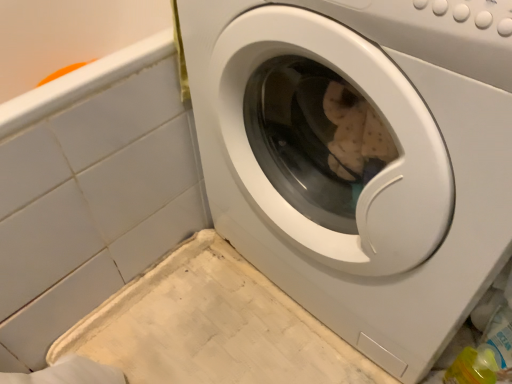
This screenshot has width=512, height=384. Find the location of `white glossy washing machine at center`. white glossy washing machine at center is located at coordinates (91, 191).

The height and width of the screenshot is (384, 512). What do you see at coordinates (91, 191) in the screenshot?
I see `white glossy washing machine at center` at bounding box center [91, 191].

Measure the distance between white glossy washing machine at center and camera.

14.00 inches.

This screenshot has width=512, height=384. What are the coordinates of `white glossy washing machine at center` in the screenshot? It's located at (361, 157).

Describe the element at coordinates (361, 157) in the screenshot. Image resolution: width=512 pixels, height=384 pixels. I see `white glossy washing machine at center` at that location.

What is the approximate height of white glossy washing machine at center?

The height of white glossy washing machine at center is 30.47 inches.

Locate an element on the screen. The image size is (512, 384). white glossy washing machine at center is located at coordinates (91, 191).

Considering the positions of objects white glossy washing machine at center and white glossy washing machine at center in the image provided, who is more to the left, white glossy washing machine at center or white glossy washing machine at center?

white glossy washing machine at center.

Is white glossy washing machine at center in front of or behind white glossy washing machine at center in the image?

white glossy washing machine at center is behind white glossy washing machine at center.

Considering the positions of point (125, 194) and point (509, 112), is point (125, 194) closer or farther from the camera than point (509, 112)?

Point (125, 194) is farther from the camera than point (509, 112).

From the image's perspective, which one is positioned higher, white glossy washing machine at center or white glossy washing machine at center?

white glossy washing machine at center, from the image's perspective.

From a real-world perspective, is white glossy washing machine at center below white glossy washing machine at center?

Yes, from a real-world perspective, white glossy washing machine at center is below white glossy washing machine at center.

Can you confirm if white glossy washing machine at center is thinner than white glossy washing machine at center?

No.

Can you confirm if white glossy washing machine at center is taller than white glossy washing machine at center?

No.

Considering the sizes of objects white glossy washing machine at center and white glossy washing machine at center in the image provided, who is smaller, white glossy washing machine at center or white glossy washing machine at center?

white glossy washing machine at center is smaller.

Could white glossy washing machine at center be considered to be inside white glossy washing machine at center?

No, white glossy washing machine at center does not contain white glossy washing machine at center.

Are white glossy washing machine at center and white glossy washing machine at center located far from each other?

They are positioned close to each other.

Is white glossy washing machine at center at the back of white glossy washing machine at center?

white glossy washing machine at center is not turned away from white glossy washing machine at center.

How many degrees apart are the facing directions of white glossy washing machine at center and white glossy washing machine at center?

90.6 degrees.

Measure the distance from white glossy washing machine at center to white glossy washing machine at center.

They are 12.97 inches apart.

I want to click on bath behind the white glossy washing machine at center, so pyautogui.click(x=91, y=191).

Is white glossy washing machine at center to the right of white glossy washing machine at center from the viewer's perspective?

Yes, white glossy washing machine at center is to the right of white glossy washing machine at center.

Which object is closer to the camera taking this photo, white glossy washing machine at center or white glossy washing machine at center?

white glossy washing machine at center.

Is point (203, 58) less distant than point (164, 12)?

Yes.

Looking at this image, from the image's perspective, is white glossy washing machine at center beneath white glossy washing machine at center?

Correct, white glossy washing machine at center appears lower than white glossy washing machine at center in the image.

From a real-world perspective, is white glossy washing machine at center above or below white glossy washing machine at center?

white glossy washing machine at center is situated higher than white glossy washing machine at center in the real world.

Considering the relative sizes of white glossy washing machine at center and white glossy washing machine at center in the image provided, is white glossy washing machine at center thinner than white glossy washing machine at center?

Indeed, white glossy washing machine at center has a lesser width compared to white glossy washing machine at center.

Considering the sizes of objects white glossy washing machine at center and white glossy washing machine at center in the image provided, who is taller, white glossy washing machine at center or white glossy washing machine at center?

white glossy washing machine at center.

Is white glossy washing machine at center bigger than white glossy washing machine at center?

Actually, white glossy washing machine at center might be smaller than white glossy washing machine at center.

Can white glossy washing machine at center be found inside white glossy washing machine at center?

Definitely not — white glossy washing machine at center is not inside white glossy washing machine at center.

Is white glossy washing machine at center far away from white glossy washing machine at center?

white glossy washing machine at center is actually quite close to white glossy washing machine at center.

Is white glossy washing machine at center aimed at white glossy washing machine at center?

No, white glossy washing machine at center is not facing towards white glossy washing machine at center.

How many degrees apart are the facing directions of white glossy washing machine at center and white glossy washing machine at center?

The facing directions of white glossy washing machine at center and white glossy washing machine at center are 90.6 degrees apart.

Could you measure the distance between white glossy washing machine at center and white glossy washing machine at center?

white glossy washing machine at center is 12.97 inches away from white glossy washing machine at center.

At what (x,y) coordinates should I click in order to perform the action: click on washing machine on the right of white glossy washing machine at center. Please return your answer as a coordinate pair (x, y). Looking at the image, I should click on (361, 157).

What are the coordinates of `washing machine that is below the white glossy washing machine at center (from the image's perspective)` in the screenshot? It's located at (361, 157).

In the image, there is a white glossy washing machine at center. Where is `bath below it (from a real-world perspective)`? bath below it (from a real-world perspective) is located at coordinates (91, 191).